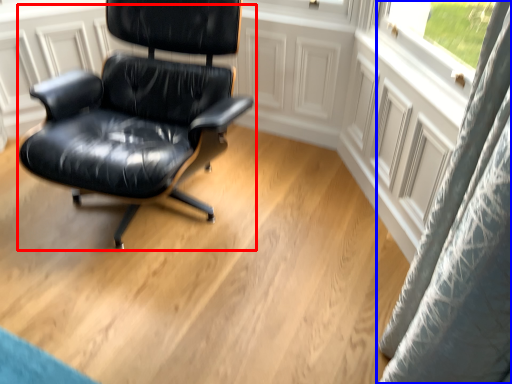
Question: Which object appears farthest to the camera in this image, chair (highlighted by a red box) or curtain (highlighted by a blue box)?

Choices:
 (A) chair
 (B) curtain

Answer: (B)